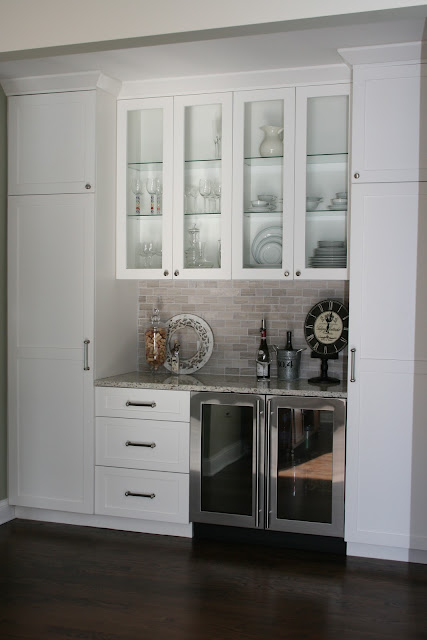
You are a GUI agent. You are given a task and a screenshot of the screen. Output one action in this format:
    pyautogui.click(x=<x>, y=<y>)
    Task: Click on the clock
    
    Given the screenshot: What is the action you would take?
    pyautogui.click(x=334, y=320)